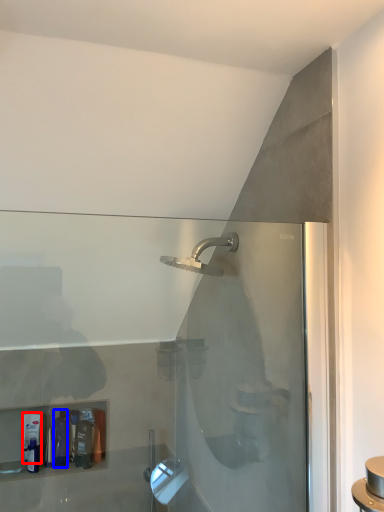
Question: Which object is further to the camera taking this photo, toiletry (highlighted by a red box) or toiletry (highlighted by a blue box)?

Choices:
 (A) toiletry
 (B) toiletry

Answer: (A)